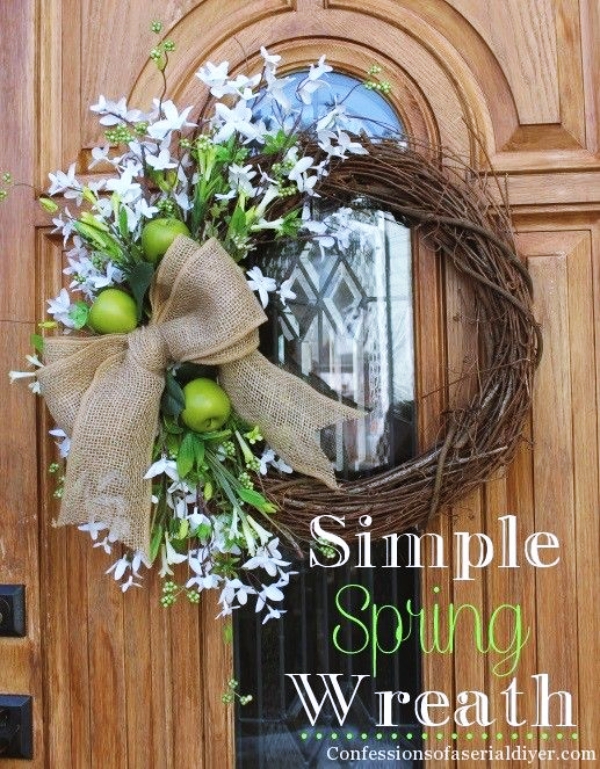
At what (x,y) coordinates should I click in order to perform the action: click on fake fruit. Please return your answer as a coordinate pair (x, y). This screenshot has width=600, height=769. Looking at the image, I should click on (209, 408), (117, 315), (160, 238).